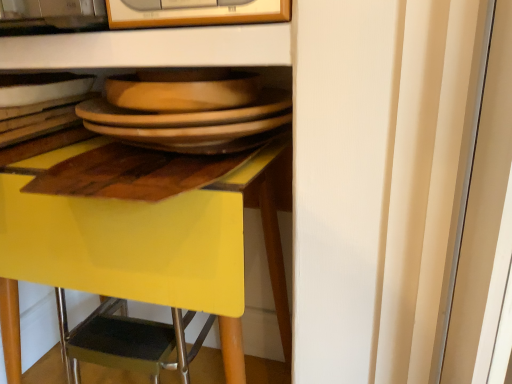
Question: From the image's perspective, does yellow glossy desk at center appear lower than matte wooden platter at center?

Choices:
 (A) yes
 (B) no

Answer: (A)

Question: Considering the relative sizes of yellow glossy desk at center and matte wooden platter at center in the image provided, is yellow glossy desk at center thinner than matte wooden platter at center?

Choices:
 (A) yes
 (B) no

Answer: (B)

Question: From a real-world perspective, is yellow glossy desk at center on top of matte wooden platter at center?

Choices:
 (A) no
 (B) yes

Answer: (A)

Question: Does yellow glossy desk at center appear on the left side of matte wooden platter at center?

Choices:
 (A) no
 (B) yes

Answer: (B)

Question: From the image's perspective, is yellow glossy desk at center above matte wooden platter at center?

Choices:
 (A) no
 (B) yes

Answer: (A)

Question: From a real-world perspective, is matte wooden platter at center above or below matte white bowl at upper left?

Choices:
 (A) below
 (B) above

Answer: (A)

Question: Considering their positions, is matte wooden platter at center located in front of or behind matte white bowl at upper left?

Choices:
 (A) behind
 (B) front

Answer: (B)

Question: Considering the relative positions of matte wooden platter at center and matte white bowl at upper left in the image provided, is matte wooden platter at center to the left or to the right of matte white bowl at upper left?

Choices:
 (A) left
 (B) right

Answer: (B)

Question: Considering the positions of matte wooden platter at center and matte white bowl at upper left in the image, is matte wooden platter at center taller or shorter than matte white bowl at upper left?

Choices:
 (A) tall
 (B) short

Answer: (A)

Question: Considering the positions of yellow glossy desk at center and matte wooden platter at center in the image, is yellow glossy desk at center taller or shorter than matte wooden platter at center?

Choices:
 (A) short
 (B) tall

Answer: (B)

Question: Visually, is yellow glossy desk at center positioned to the left or to the right of matte wooden platter at center?

Choices:
 (A) left
 (B) right

Answer: (A)

Question: In the image, is yellow glossy desk at center positioned in front of or behind matte wooden platter at center?

Choices:
 (A) behind
 (B) front

Answer: (B)

Question: Is yellow glossy desk at center inside the boundaries of matte wooden platter at center, or outside?

Choices:
 (A) inside
 (B) outside

Answer: (B)

Question: Would you say wooden frame at upper center is to the left or to the right of matte white bowl at upper left in the picture?

Choices:
 (A) right
 (B) left

Answer: (A)

Question: In the image, is wooden frame at upper center positioned in front of or behind matte white bowl at upper left?

Choices:
 (A) behind
 (B) front

Answer: (B)